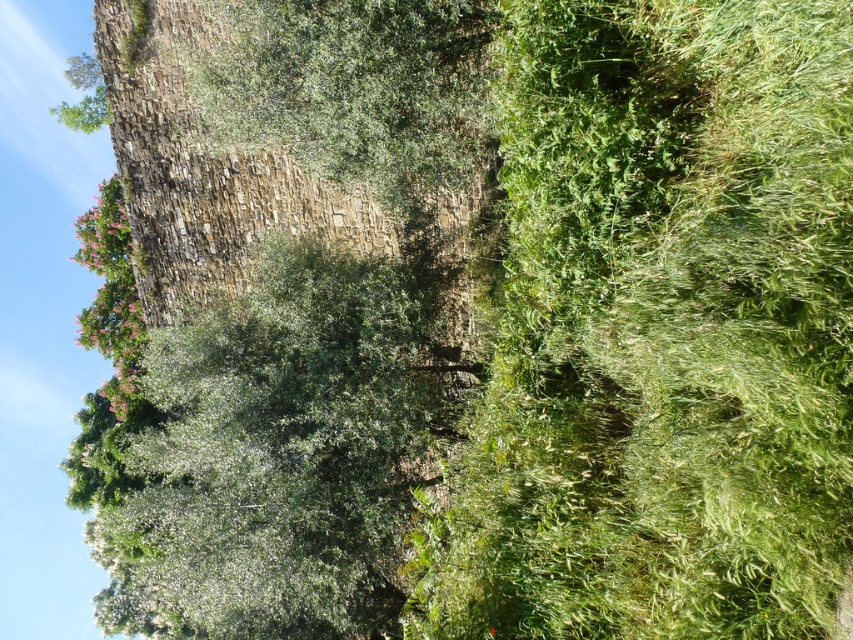
You are standing at the base of the green leafy tree at upper center and want to throw a ball to your friend who is 50 feet away from you. Can you reach your friend with the throw?

The distance between you and your friend is 50 feet, but the green leafy tree at upper center is only 47.48 feet away from the viewer. Therefore, your friend is slightly farther than the tree, so you might need to throw a bit harder to reach them.

You are a landscape architect designing a garden and want to place both the green leafy tree at upper center and the pink matte tree at upper left in a new layout. Based on their sizes, which tree would require more space in the garden?

The pink matte tree at upper left requires more space because it occupies more area than the green leafy tree at upper center.